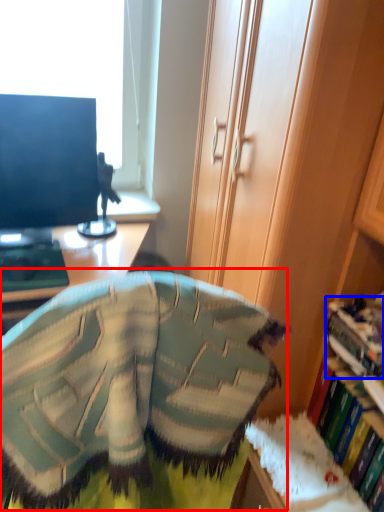
Question: Among these objects, which one is nearest to the camera, bean bag chair (highlighted by a red box) or book (highlighted by a blue box)?

Choices:
 (A) bean bag chair
 (B) book

Answer: (A)